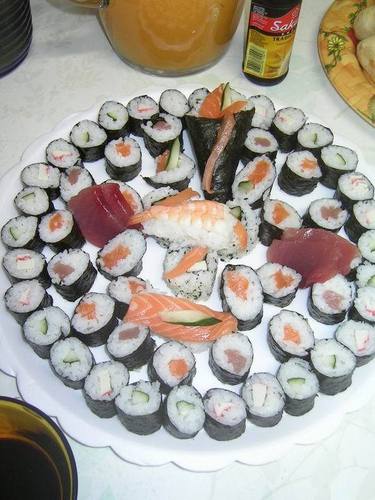
Identify the location of platter. (112, 443).